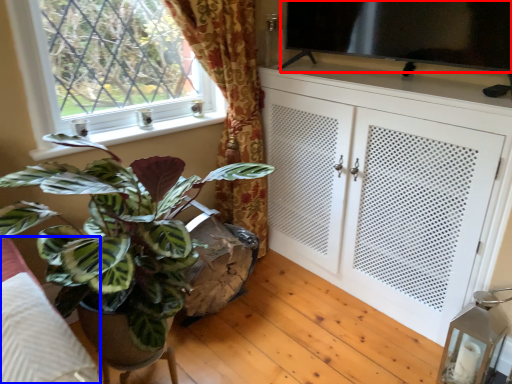
Question: Which object appears farthest to the camera in this image, window screen (highlighted by a red box) or bedding (highlighted by a blue box)?

Choices:
 (A) window screen
 (B) bedding

Answer: (A)